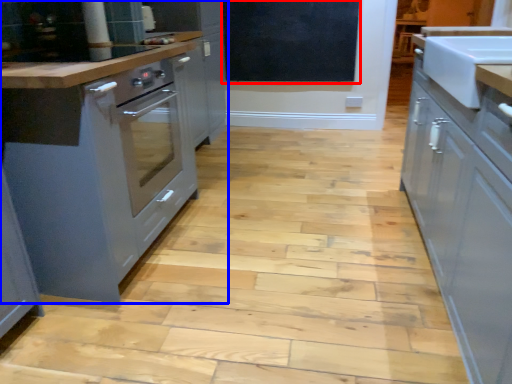
Question: Which point is closer to the camera, bulletin board (highlighted by a red box) or cabinetry (highlighted by a blue box)?

Choices:
 (A) bulletin board
 (B) cabinetry

Answer: (B)